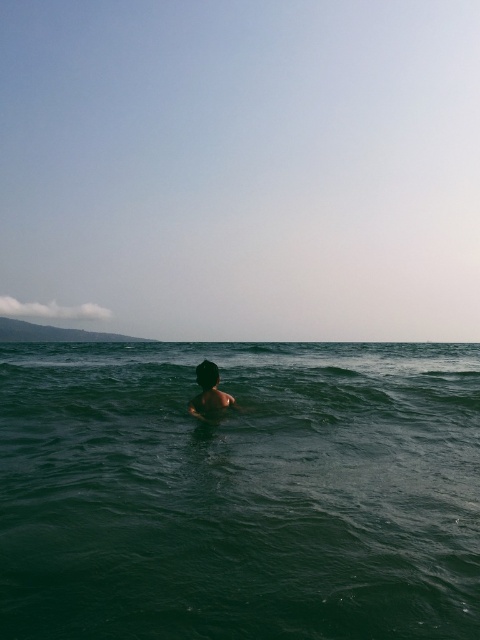
You are standing on a beach and notice the green liquid water at center and the dark brown hair at center. Which object is taller from your viewpoint?

The green liquid water at center is taller than the dark brown hair at center according to the description.

You are a photographer trying to capture the reflection of the dark brown hair at center in the green liquid water at center. Based on the scene, can you confirm if the reflection will be fully visible within the water?

The green liquid water at center is bigger than dark brown hair at center, so the reflection of the dark brown hair at center should be fully visible within the water as the water area is larger than the hair.

Consider the image. You are standing at the edge of the cliff overlooking the ocean and see the green liquid water at center and the dark brown hair at center. Which one is closer to you?

The dark brown hair at center is closer to you because it is only 29.98 meters away from the green liquid water at center, but since both are at the center, the dark brown hair is likely on the cliff edge near you while the water is further out.